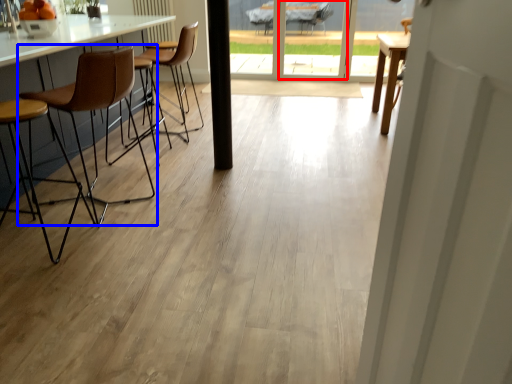
Question: Which of the following is the closest to the observer, screen door (highlighted by a red box) or chair (highlighted by a blue box)?

Choices:
 (A) screen door
 (B) chair

Answer: (B)